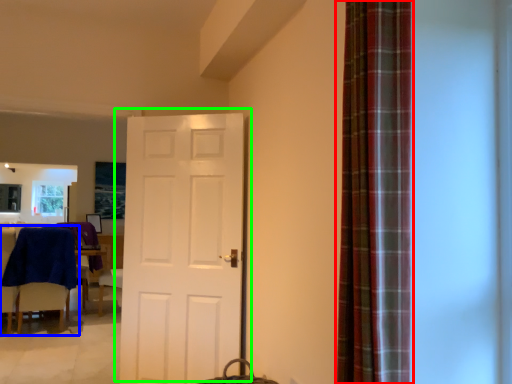
Question: Which object is positioned farthest from curtain (highlighted by a red box)? Select from chair (highlighted by a blue box) and door (highlighted by a green box).

Choices:
 (A) chair
 (B) door

Answer: (A)